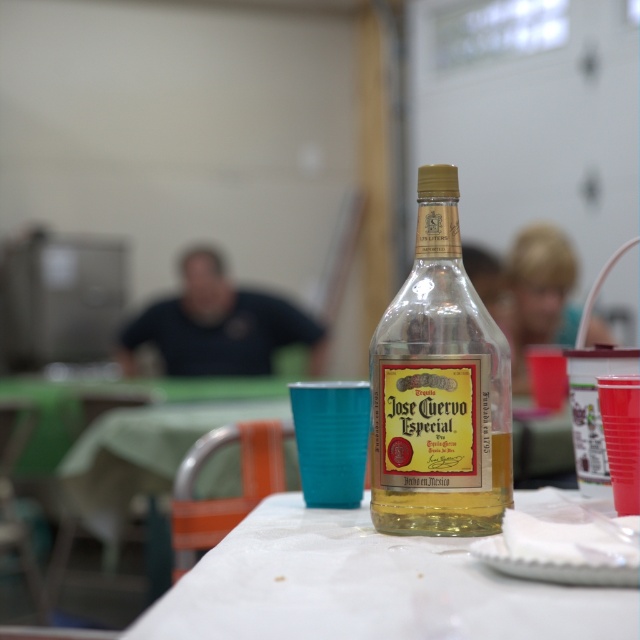
You are at a party and want to grab the clear glass bottle at center. However, there is a person with blonde hair at upper right blocking your view. Can you reach the bottle without moving the person?

The clear glass bottle at center is shorter than blonde hair at upper right, so the bottle is shorter than the person with blonde hair at upper right. Since the person is blocking your view, you might need to move them to reach the bottle.